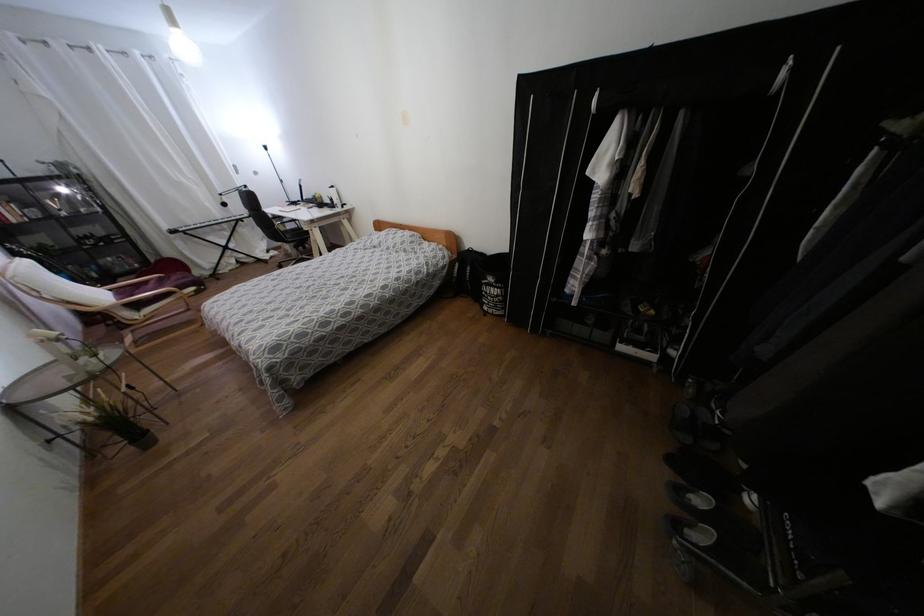
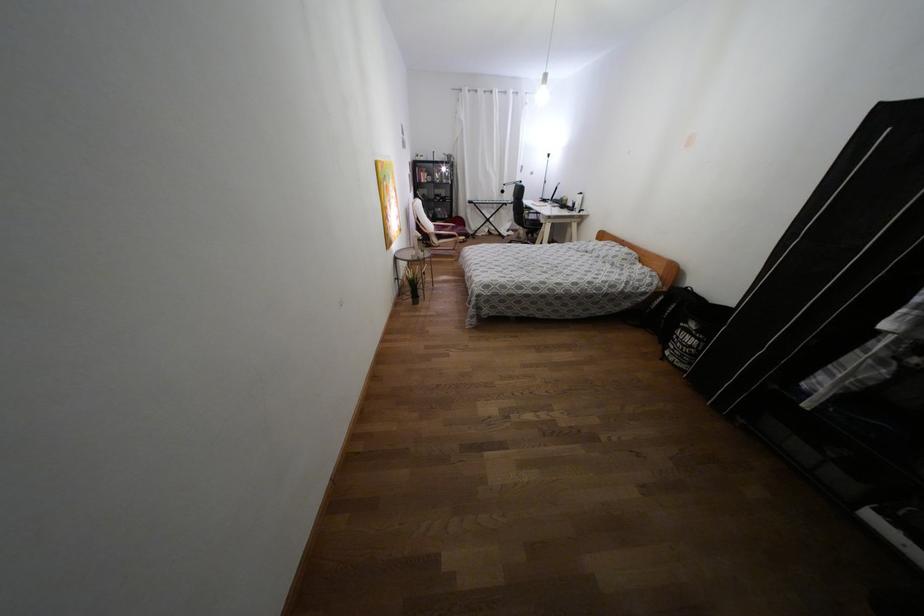
Locate, in the second image, the point that corresponds to point 485,293 in the first image.

(676, 337)